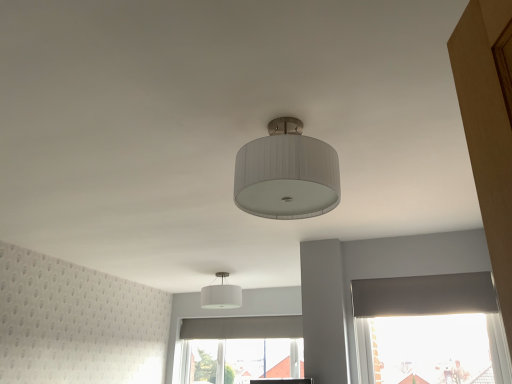
Question: Is white textured lampshade at center, the 1th lamp in the front-to-back sequence, wider or thinner than transparent plastic window screen at lower right?

Choices:
 (A) wide
 (B) thin

Answer: (A)

Question: Considering the positions of white textured lampshade at center, the second lamp viewed from the back, and transparent plastic window screen at lower right in the image, is white textured lampshade at center, the second lamp viewed from the back, taller or shorter than transparent plastic window screen at lower right?

Choices:
 (A) short
 (B) tall

Answer: (A)

Question: Which of these objects is positioned farthest from the white textured lampshade at center, which is counted as the 2th lamp, starting from the bottom?

Choices:
 (A) white fabric lampshade at center, acting as the 1th lamp starting from the bottom
 (B) transparent plastic window screen at lower right

Answer: (A)

Question: Which of these objects is positioned closest to the transparent plastic window screen at lower right?

Choices:
 (A) white textured lampshade at center, the second lamp viewed from the back
 (B) white fabric lampshade at center, acting as the second lamp starting from the right

Answer: (B)